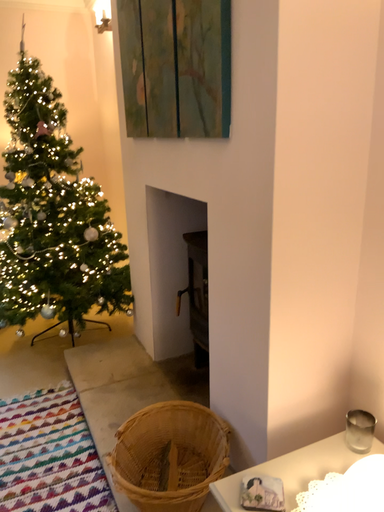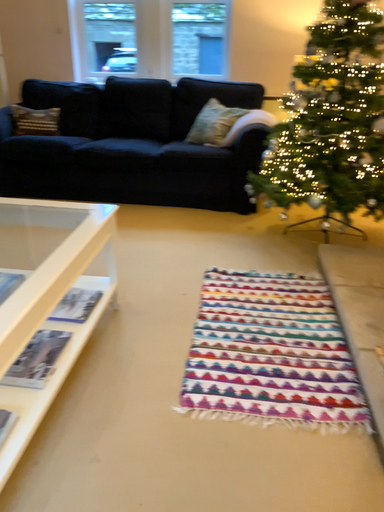
Question: How did the camera likely rotate when shooting the video?

Choices:
 (A) rotated left
 (B) rotated right

Answer: (A)